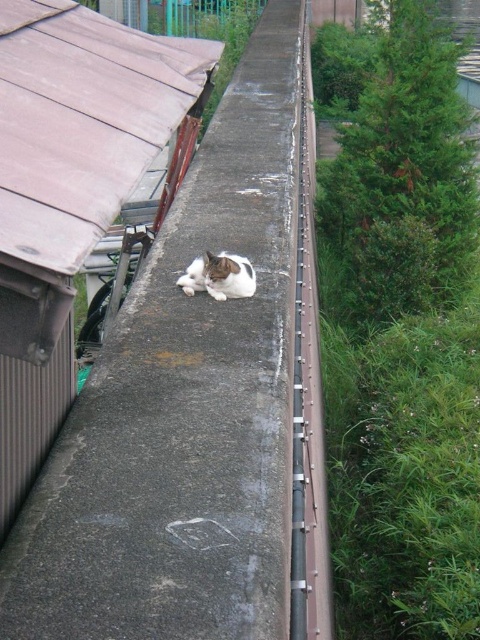
Question: Which of the following is the farthest from the observer?

Choices:
 (A) (215, 262)
 (B) (307, 58)
 (C) (292, 634)

Answer: (B)

Question: Does gray concrete ledge at center lie behind white-furred cat at center?

Choices:
 (A) yes
 (B) no

Answer: (B)

Question: Which of the following is the closest to the observer?

Choices:
 (A) (251, 268)
 (B) (300, 592)
 (C) (248, 612)

Answer: (C)

Question: Is metallic gray train track at center thinner than white-furred cat at center?

Choices:
 (A) yes
 (B) no

Answer: (B)

Question: Among these points, which one is farthest from the camera?

Choices:
 (A) tap(312, 596)
 (B) tap(245, 49)
 (C) tap(253, 291)

Answer: (B)

Question: Can you confirm if gray concrete ledge at center is wider than metallic gray train track at center?

Choices:
 (A) yes
 (B) no

Answer: (A)